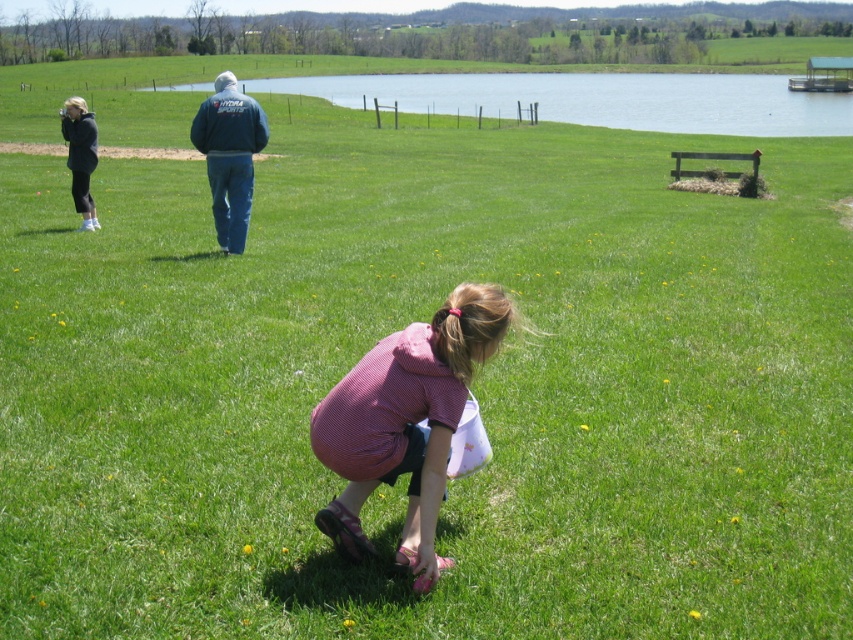
Question: Which object is closer to the camera taking this photo?

Choices:
 (A) blue water at upper center
 (B) pink fabric dress at center

Answer: (B)

Question: Does blue water at upper center come behind matte black jacket at left?

Choices:
 (A) yes
 (B) no

Answer: (A)

Question: Which object is positioned farthest from the pink fabric dress at center?

Choices:
 (A) matte black jacket at left
 (B) blue water at upper center
 (C) denim jacket at upper center

Answer: (B)

Question: Does denim jacket at upper center have a lesser width compared to matte black jacket at left?

Choices:
 (A) no
 (B) yes

Answer: (A)

Question: Considering the real-world distances, which object is farthest from the blue water at upper center?

Choices:
 (A) denim jacket at upper center
 (B) matte black jacket at left

Answer: (B)

Question: Is blue water at upper center to the right of matte black jacket at left from the viewer's perspective?

Choices:
 (A) yes
 (B) no

Answer: (A)